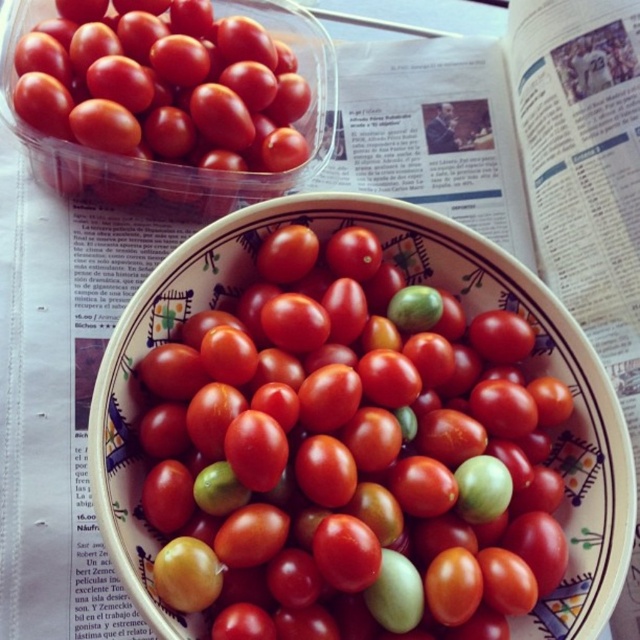
Between green matte cherry tomato at center and glossy plastic container at upper left, which one has less height?

With less height is glossy plastic container at upper left.

Does green matte cherry tomato at center have a greater height compared to glossy plastic container at upper left?

Yes, green matte cherry tomato at center is taller than glossy plastic container at upper left.

Does point (243, 529) come behind point (180, 106)?

No, it is in front of (180, 106).

Locate an element on the screen. The height and width of the screenshot is (640, 640). green matte cherry tomato at center is located at coordinates (349, 456).